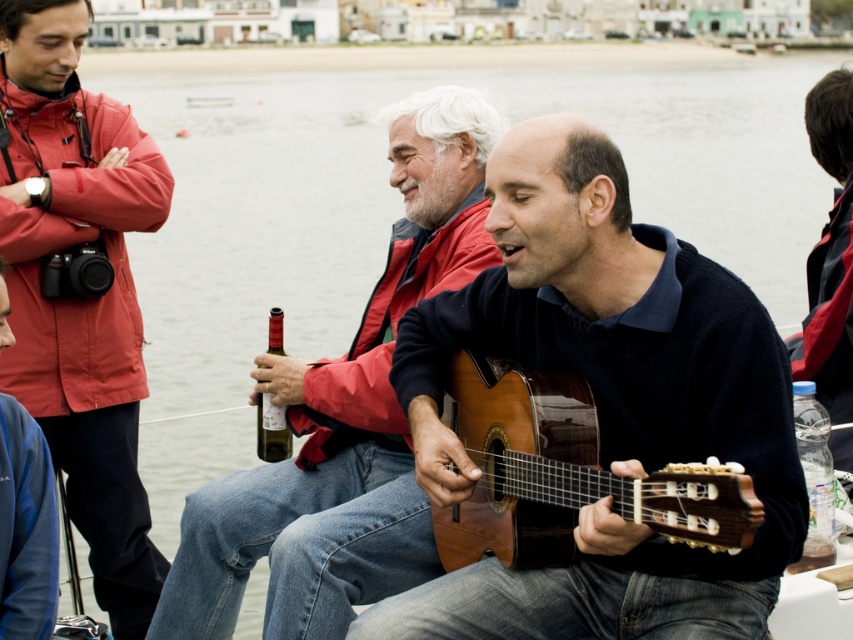
You are a photographer trying to capture the man playing the acoustic guitar. You notice that the man on the right is at point (602,404). Where exactly should you focus your camera to ensure the acoustic guitar is in the center of the photo?

You should focus your camera at point (602,404) because that is where the wooden acoustic guitar at center is located.

You are a photographer at the event and want to capture a photo of both the wooden acoustic guitar at center and the matte brown guitar at center. Which guitar should you position to the left side of your frame to include both in the shot?

The matte brown guitar at center should be positioned to the left side of your frame because the wooden acoustic guitar at center is already to the right of it, allowing both guitars to fit within the shot.